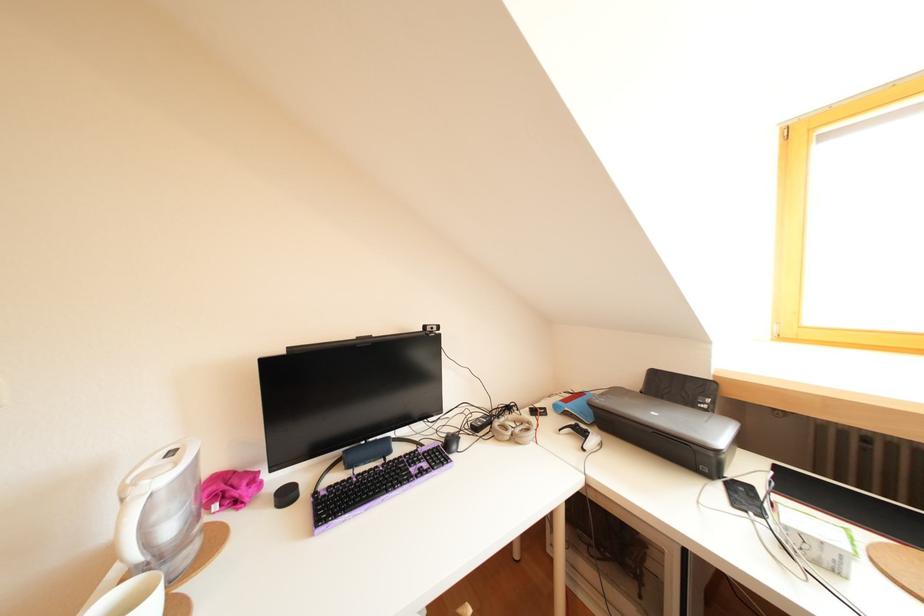
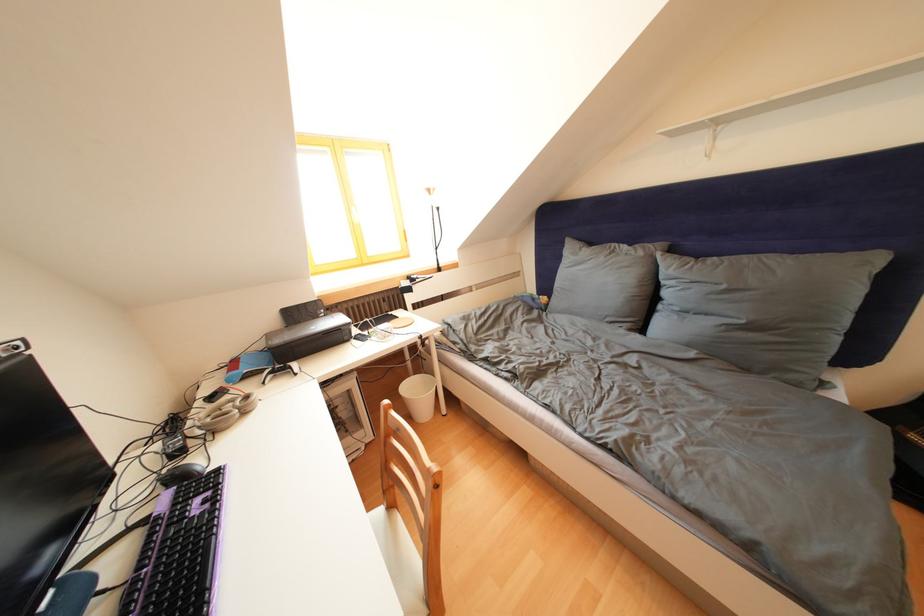
Where in the second image is the point corresponding to [542,416] from the first image?

(220, 403)